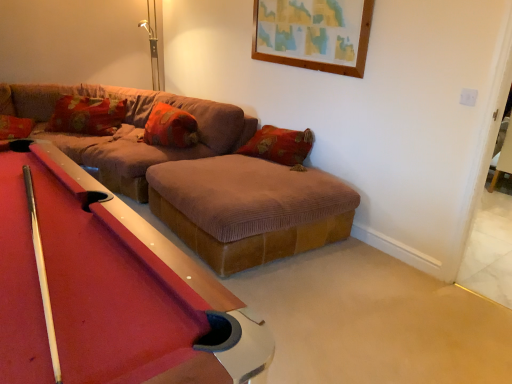
Question: From their relative heights in the image, would you say rubberized felt pool table at center is taller or shorter than brown corduroy couch at center?

Choices:
 (A) short
 (B) tall

Answer: (B)

Question: From the image's perspective, is rubberized felt pool table at center located above or below brown corduroy couch at center?

Choices:
 (A) below
 (B) above

Answer: (A)

Question: Which object is the closest to the brown corduroy footrest at center?

Choices:
 (A) corduroy pillow at upper left, marked as the second pillow in a right-to-left arrangement
 (B) rubberized felt pool table at center
 (C) brown corduroy couch at center
 (D) velvet orange pillow at center, acting as the first pillow starting from the right

Answer: (C)

Question: Considering the real-world distances, which object is closest to the velvet orange pillow at center, acting as the first pillow starting from the right?

Choices:
 (A) brown corduroy couch at center
 (B) rubberized felt pool table at center
 (C) brown corduroy footrest at center
 (D) corduroy pillow at upper left, marked as the second pillow in a right-to-left arrangement

Answer: (A)